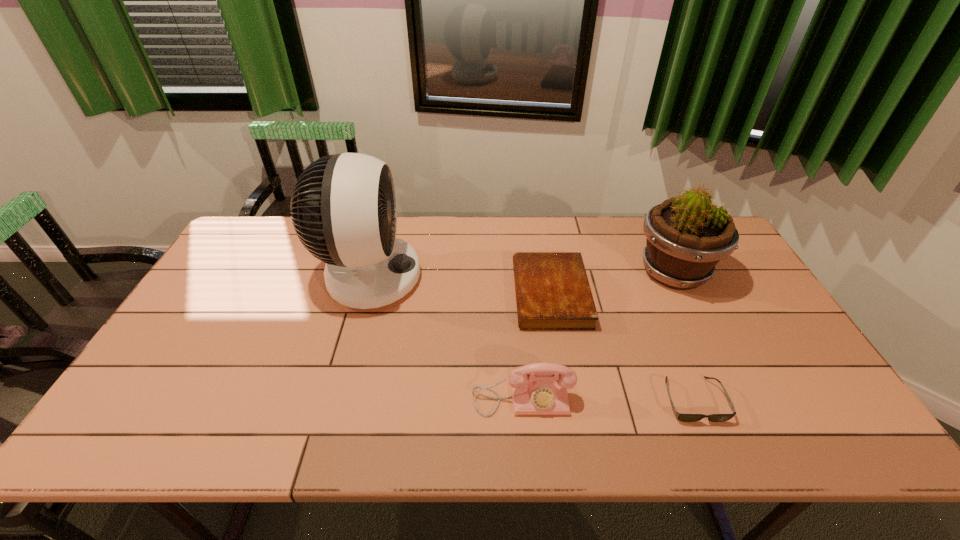
You are a GUI agent. You are given a task and a screenshot of the screen. Output one action in this format:
    pyautogui.click(x=<x>, y=<y>)
    Task: Click on the vacant space situated 0.050m on the spine side of the Bible
    
    Given the screenshot: What is the action you would take?
    pyautogui.click(x=498, y=294)

Identify the location of fan present at the far edge. The width and height of the screenshot is (960, 540). (344, 212).

At what (x,y) coordinates should I click in order to perform the action: click on flowerpot at the far edge. Please return your answer as a coordinate pair (x, y). The width and height of the screenshot is (960, 540). Looking at the image, I should click on (687, 235).

You are a GUI agent. You are given a task and a screenshot of the screen. Output one action in this format:
    pyautogui.click(x=<x>, y=<y>)
    Task: Click on the telephone positioned at the near edge
    
    Given the screenshot: What is the action you would take?
    pyautogui.click(x=540, y=388)

This screenshot has height=540, width=960. I want to click on sunglasses situated at the near edge, so click(681, 417).

This screenshot has width=960, height=540. In order to click on object that is at the right edge in this screenshot , I will do `click(687, 235)`.

In order to click on object that is at the far right corner in this screenshot , I will do `click(687, 235)`.

At what (x,y) coordinates should I click in order to perform the action: click on free space at the far edge. Please return your answer as a coordinate pair (x, y). Looking at the image, I should click on (574, 242).

In the image, there is a desktop. In order to click on free space at the near edge in this screenshot , I will do `click(752, 426)`.

You are a GUI agent. You are given a task and a screenshot of the screen. Output one action in this format:
    pyautogui.click(x=<x>, y=<y>)
    Task: Click on the vacant space at the left edge of the desktop
    The width and height of the screenshot is (960, 540).
    Given the screenshot: What is the action you would take?
    pyautogui.click(x=204, y=304)